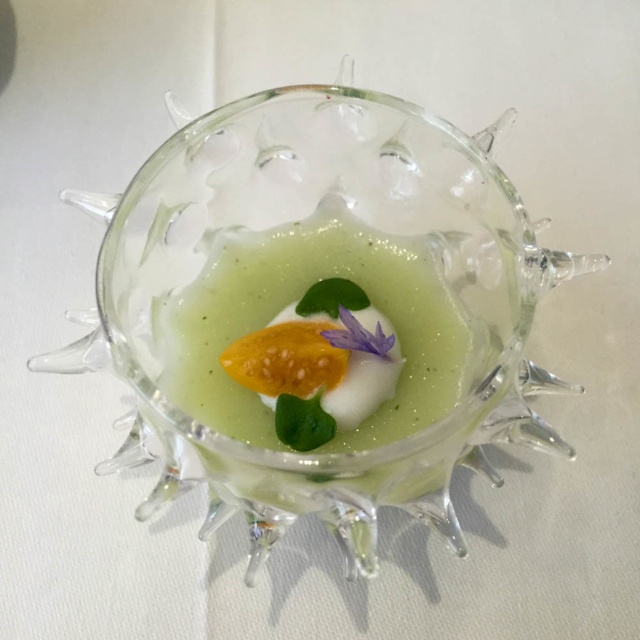
Question: Does transparent glass bowl at center have a greater width compared to green gelatinous at center?

Choices:
 (A) no
 (B) yes

Answer: (B)

Question: Observing the image, what is the correct spatial positioning of transparent glass bowl at center in reference to green gelatinous at center?

Choices:
 (A) right
 (B) left

Answer: (A)

Question: Which object is closer to the camera taking this photo?

Choices:
 (A) green gelatinous at center
 (B) matte yellow fruit at center
 (C) transparent glass bowl at center

Answer: (C)

Question: Which of the following is the closest to the observer?

Choices:
 (A) (433, 296)
 (B) (428, 355)

Answer: (B)

Question: Does green gelatinous at center appear under matte yellow fruit at center?

Choices:
 (A) no
 (B) yes

Answer: (A)

Question: Which point is closer to the camera?

Choices:
 (A) coord(256,260)
 (B) coord(339,365)
 (C) coord(349,404)

Answer: (B)